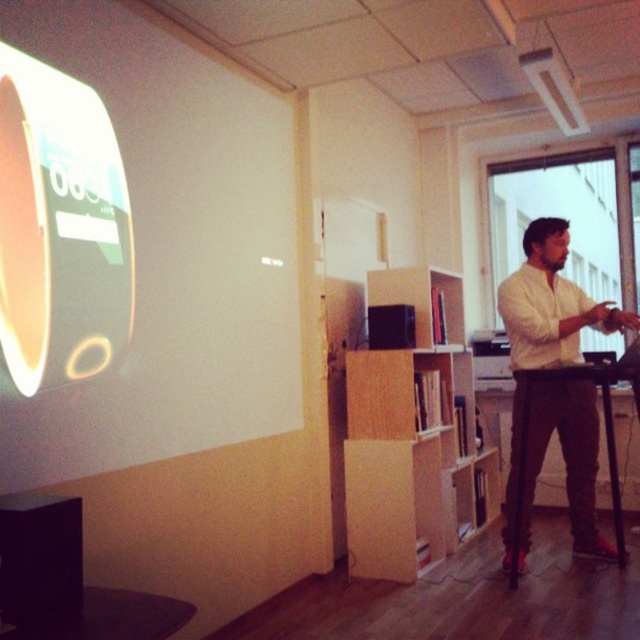
Is white matte projection screen at upper left further to the viewer compared to wooden bookshelf at center?

No.

Which is in front, point (38, 435) or point (452, 413)?

Positioned in front is point (38, 435).

At what (x,y) coordinates should I click in order to perform the action: click on white matte projection screen at upper left. Please return your answer as a coordinate pair (x, y). This screenshot has width=640, height=640. Looking at the image, I should click on (173, 256).

Does white matte projection screen at upper left lie behind white cotton shirt at right?

No, white matte projection screen at upper left is in front of white cotton shirt at right.

Is white matte projection screen at upper left to the right of white cotton shirt at right from the viewer's perspective?

No, white matte projection screen at upper left is not to the right of white cotton shirt at right.

This screenshot has width=640, height=640. I want to click on white matte projection screen at upper left, so click(x=173, y=256).

Does wooden bookshelf at center have a greater height compared to white cotton shirt at right?

No.

Where is `wooden bookshelf at center`? wooden bookshelf at center is located at coordinates (413, 438).

Between point (429, 419) and point (595, 452), which one is positioned behind?

The point (429, 419) is more distant.

Where is `wooden bookshelf at center`? wooden bookshelf at center is located at coordinates (413, 438).